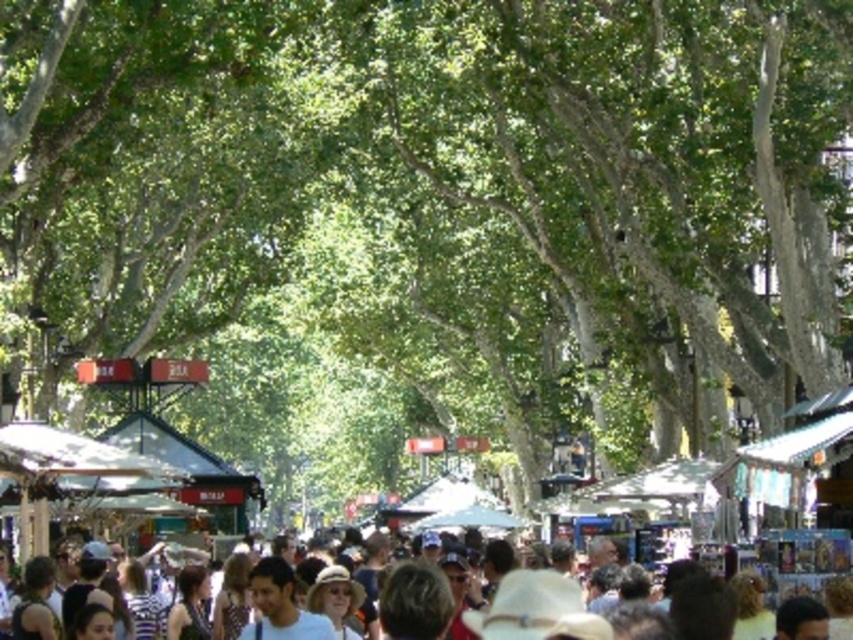
You are standing at the edge of the market and notice both the multicolored fabric crowd at center and the light brown hair at center. From your perspective, which object is located to the right?

The light brown hair at center is located to the right of the multicolored fabric crowd at center.

You are a photographer standing at the edge of the market. You want to take a photo that includes both the multicolored fabric crowd at center and the light brown hair at center. Which object should you focus on first to ensure both are in focus?

The multicolored fabric crowd at center is closer to the viewer than the light brown hair at center. To ensure both are in focus, focus on the multicolored fabric crowd at center first, as it is the closer object.